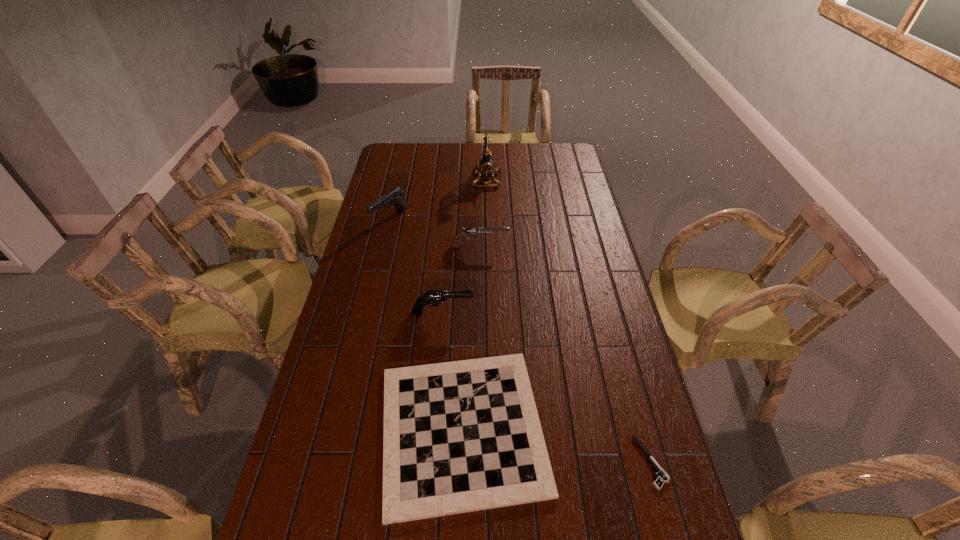
Where is `the tallest object`? the tallest object is located at coordinates (486, 166).

You are a GUI agent. You are given a task and a screenshot of the screen. Output one action in this format:
    pyautogui.click(x=<x>, y=<y>)
    Task: Click on the telephone
    
    Given the screenshot: What is the action you would take?
    pyautogui.click(x=486, y=166)

I want to click on the farthest gun, so [x=394, y=197].

At what (x,y) coordinates should I click in order to perform the action: click on the leftmost object. Please return your answer as a coordinate pair (x, y). Looking at the image, I should click on (394, 197).

Find the location of a particular element. The image size is (960, 540). the second tallest gun is located at coordinates coord(434,297).

Identify the location of the fourth shortest object. (434, 297).

I want to click on the shortest gun, so click(470, 231).

Locate an element on the screen. the third farthest object is located at coordinates (470, 231).

Locate an element on the screen. The image size is (960, 540). the fifth tallest object is located at coordinates (461, 436).

Locate an element on the screen. This screenshot has height=540, width=960. pistol is located at coordinates (663, 477).